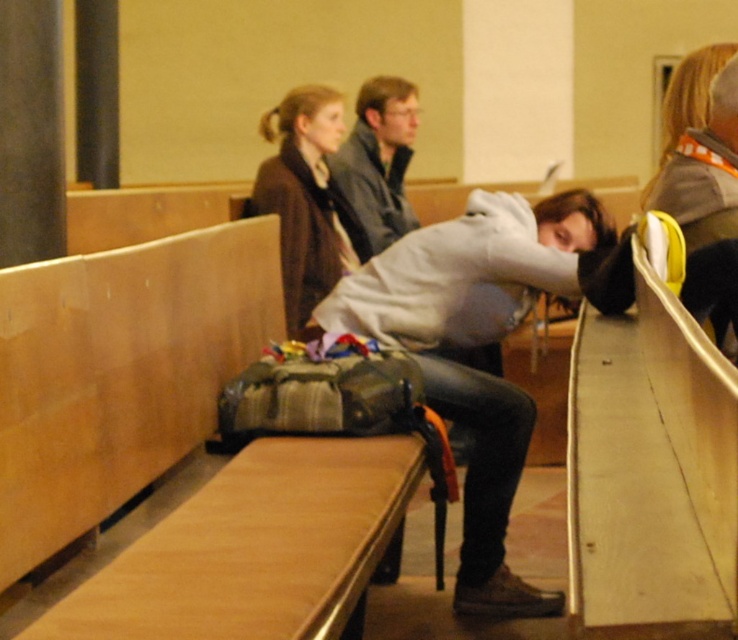
Question: Does matte brown jacket at upper center appear under matte gray jacket at center?

Choices:
 (A) no
 (B) yes

Answer: (B)

Question: Estimate the real-world distances between objects in this image. Which object is closer to the white matte hoodie at center?

Choices:
 (A) matte brown jacket at upper center
 (B) wooden bench at center

Answer: (B)

Question: Which point is farther from the camera taking this photo?

Choices:
 (A) (268, 157)
 (B) (339, 157)

Answer: (B)

Question: Is white matte hoodie at center closer to the viewer compared to matte brown jacket at upper center?

Choices:
 (A) no
 (B) yes

Answer: (B)

Question: Which point is farther to the camera?

Choices:
 (A) (348, 136)
 (B) (337, 273)
 (C) (387, 506)

Answer: (A)

Question: Is wooden bench at center thinner than white matte hoodie at center?

Choices:
 (A) yes
 (B) no

Answer: (A)